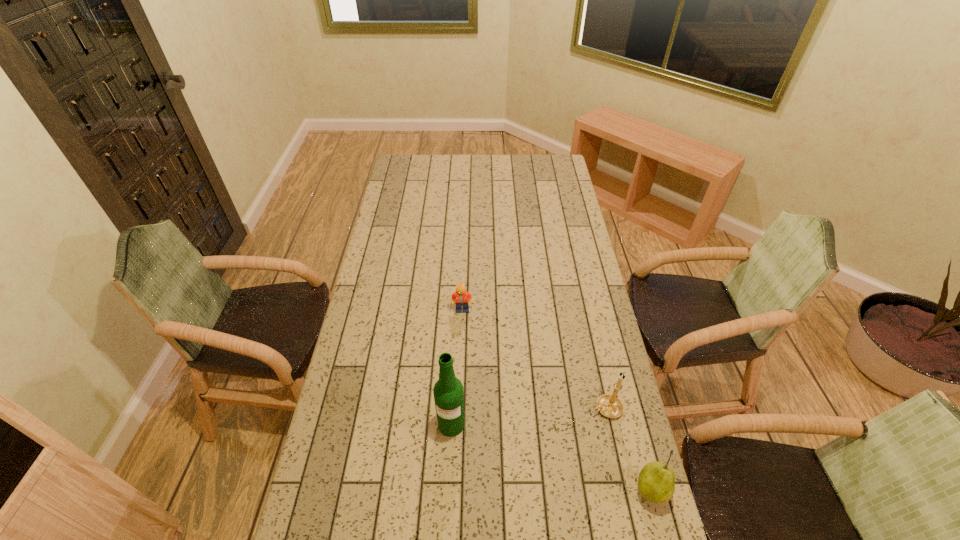
Locate an element on the screen. This screenshot has height=540, width=960. the tallest object is located at coordinates (448, 391).

Find the location of a particular element. the nearest object is located at coordinates (656, 484).

Locate an element on the screen. candle holder is located at coordinates (609, 405).

At what (x,y) coordinates should I click in order to perform the action: click on the farthest object. Please return your answer as a coordinate pair (x, y). This screenshot has height=540, width=960. Looking at the image, I should click on (460, 297).

This screenshot has height=540, width=960. I want to click on vacant space located on the label of the beer bottle, so click(447, 502).

The width and height of the screenshot is (960, 540). In order to click on free spot located 0.150m on the back of the pear in this screenshot , I will do [632, 421].

Identify the location of free location located on the handle side of the candle holder. (573, 421).

Locate an element on the screen. The height and width of the screenshot is (540, 960). vacant position located on the handle side of the candle holder is located at coordinates (484, 460).

Where is `free space located on the handle side of the candle holder`? free space located on the handle side of the candle holder is located at coordinates pos(512,448).

The width and height of the screenshot is (960, 540). I want to click on free space located on the front-facing side of the Lego, so click(508, 401).